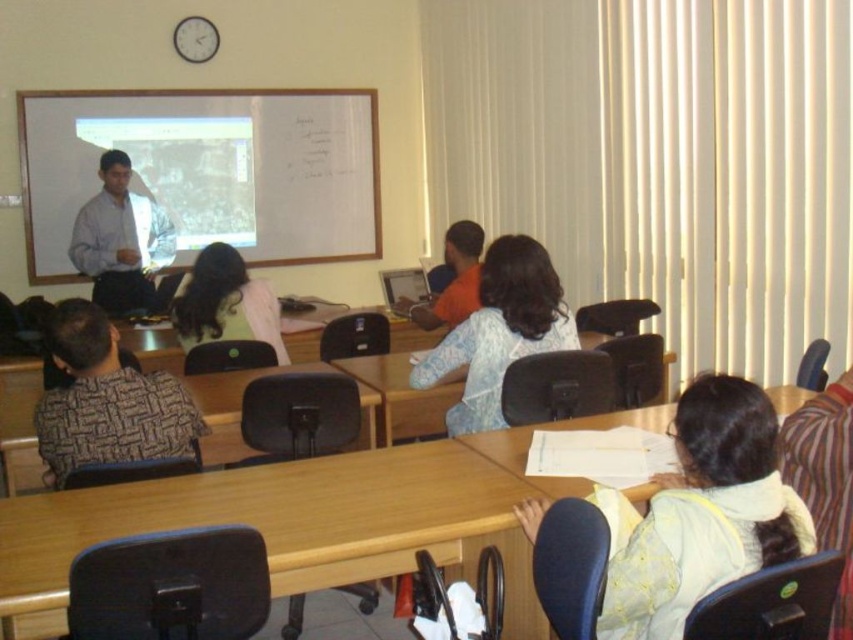
You are a student in the classroom and you need to place your notebook on the light brown wood table at center. To do so, you must first walk from your desk to the table. Which direction should you move relative to the light yellow fabric at lower right?

The light brown wood table at center is located below the light yellow fabric at lower right, so you should move downward from the light yellow fabric at lower right to reach the table.

You are a student sitting in the classroom and want to see both the light yellow fabric at lower right and the patterned fabric shirt at left. Which one appears larger in your view?

The light yellow fabric at lower right appears larger because it is closer to the viewer than the patterned fabric shirt at left.